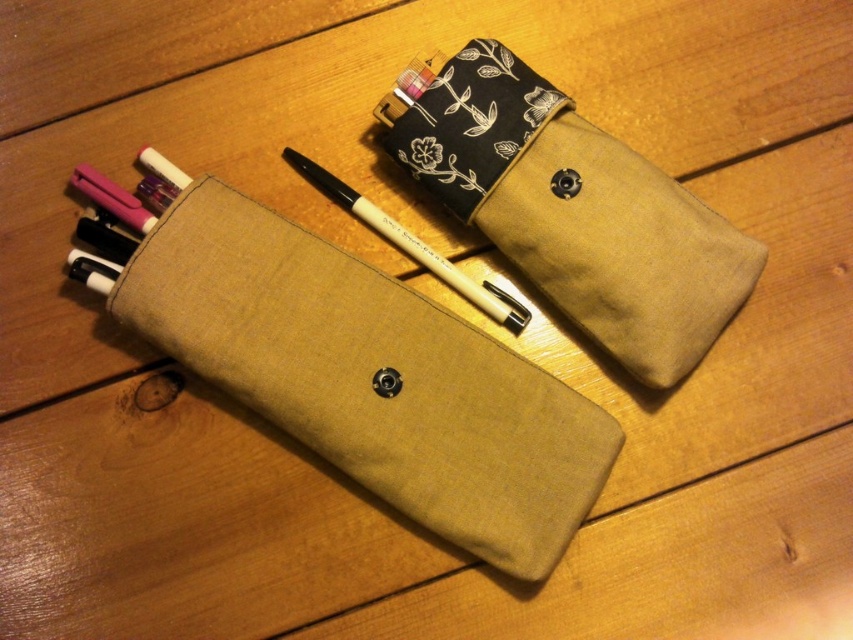
Question: In this image, where is canvas pouch at center located relative to white matte pen at center?

Choices:
 (A) right
 (B) left

Answer: (B)

Question: Which object is positioned farthest from the white matte pen at center?

Choices:
 (A) canvas pouch at upper center
 (B) canvas pouch at center

Answer: (B)

Question: Which of the following is the closest to the observer?

Choices:
 (A) canvas pouch at upper center
 (B) canvas pouch at center

Answer: (B)

Question: Is canvas pouch at center above canvas pouch at upper center?

Choices:
 (A) no
 (B) yes

Answer: (A)

Question: Can you confirm if canvas pouch at center is smaller than canvas pouch at upper center?

Choices:
 (A) yes
 (B) no

Answer: (B)

Question: Which object is the farthest from the canvas pouch at center?

Choices:
 (A) white matte pen at center
 (B) canvas pouch at upper center

Answer: (B)